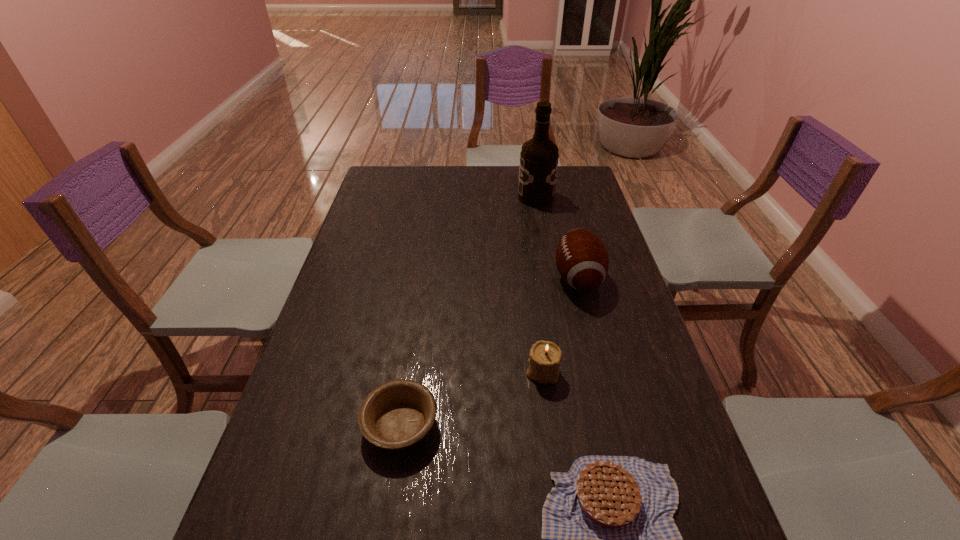
The height and width of the screenshot is (540, 960). What are the coordinates of `free space located 0.060m on the label of the alcohol` in the screenshot? It's located at (503, 198).

This screenshot has height=540, width=960. What are the coordinates of `blank area located on the laces of the second farthest object` in the screenshot? It's located at (537, 279).

At what (x,y) coordinates should I click in order to perform the action: click on free location located 0.230m on the laces of the second farthest object. Please return your answer as a coordinate pair (x, y). The image size is (960, 540). Looking at the image, I should click on (479, 279).

The image size is (960, 540). Identify the location of vacant area situated 0.340m on the laces of the second farthest object. (443, 279).

Locate an element on the screen. vacant space located on the left of the third shortest object is located at coordinates (506, 371).

This screenshot has width=960, height=540. I want to click on vacant region located 0.120m on the front of the bowl, so click(x=386, y=523).

The width and height of the screenshot is (960, 540). What are the coordinates of `object at the far edge` in the screenshot? It's located at (539, 156).

The width and height of the screenshot is (960, 540). I want to click on object that is at the right edge, so click(582, 260).

The image size is (960, 540). Find the location of `free region at the left edge of the desktop`. free region at the left edge of the desktop is located at coordinates (372, 241).

Image resolution: width=960 pixels, height=540 pixels. In the image, there is a desktop. In order to click on free space at the right edge in this screenshot , I will do `click(561, 200)`.